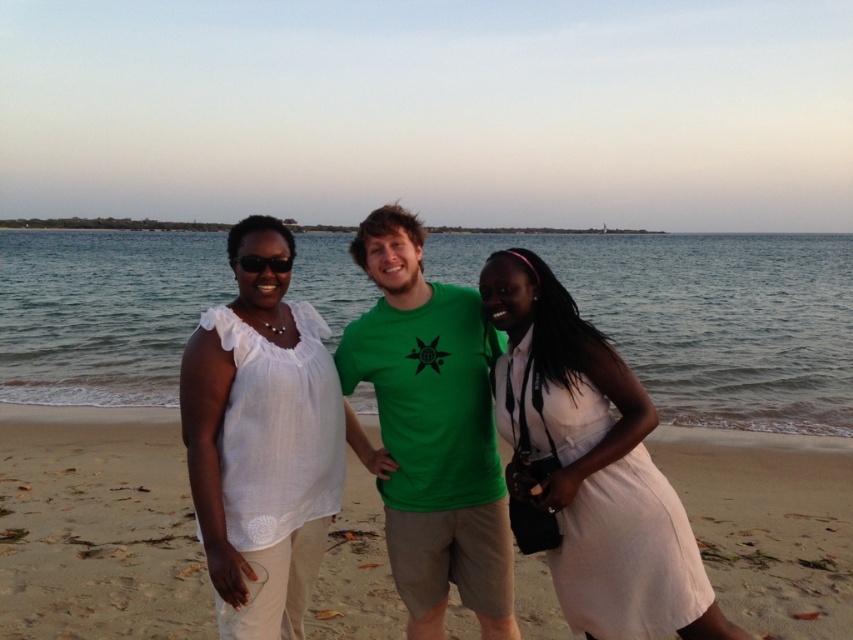
Question: Which object appears farthest from the camera in this image?

Choices:
 (A) green matte t-shirt at center
 (B) clear blue water at center
 (C) sandy beach at center
 (D) white linen blouse at center

Answer: (C)

Question: Which point is closer to the camera?

Choices:
 (A) pos(387,563)
 (B) pos(55,272)
 (C) pos(415,600)

Answer: (C)

Question: Does white satin dress at center have a larger size compared to white linen blouse at center?

Choices:
 (A) yes
 (B) no

Answer: (B)

Question: Where is white satin dress at center located in relation to green matte t-shirt at center in the image?

Choices:
 (A) below
 (B) above

Answer: (B)

Question: Is the position of clear blue water at center more distant than that of green matte t-shirt at center?

Choices:
 (A) no
 (B) yes

Answer: (B)

Question: Which point is closer to the camera?

Choices:
 (A) sandy beach at center
 (B) clear blue water at center
 (C) white linen blouse at center

Answer: (C)